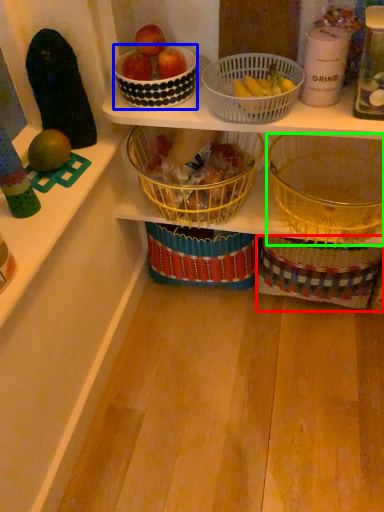
Question: Which is nearer to the gift basket (highlighted by a red box)? bowl (highlighted by a blue box) or basket (highlighted by a green box).

Choices:
 (A) bowl
 (B) basket

Answer: (B)